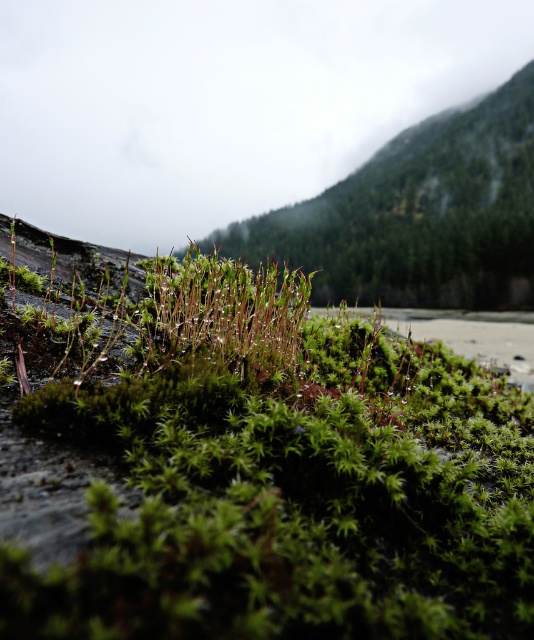
Is green mossy hillside at upper center bigger than green mossy plant at center?

Correct, green mossy hillside at upper center is larger in size than green mossy plant at center.

Can you confirm if green mossy hillside at upper center is positioned below green mossy plant at center?

Actually, green mossy hillside at upper center is above green mossy plant at center.

Which is behind, point (523, 83) or point (244, 378)?

The point (523, 83) is more distant.

I want to click on green mossy hillside at upper center, so click(x=419, y=216).

Is green fuzzy moss at center further to the viewer compared to green mossy plant at center?

No, green fuzzy moss at center is closer to the viewer.

Which of these two, green fuzzy moss at center or green mossy plant at center, stands taller?

With more height is green fuzzy moss at center.

Does point (316, 477) lie behind point (249, 369)?

No, it is not.

This screenshot has height=640, width=534. I want to click on green fuzzy moss at center, so click(x=277, y=470).

Is green fuzzy moss at center to the left of green mossy hillside at upper center from the viewer's perspective?

Yes, green fuzzy moss at center is to the left of green mossy hillside at upper center.

Does green fuzzy moss at center have a smaller size compared to green mossy hillside at upper center?

Correct, green fuzzy moss at center occupies less space than green mossy hillside at upper center.

Does point (192, 440) lie behind point (239, 241)?

No, (192, 440) is in front of (239, 241).

Locate an element on the screen. This screenshot has width=534, height=640. green fuzzy moss at center is located at coordinates pos(277,470).